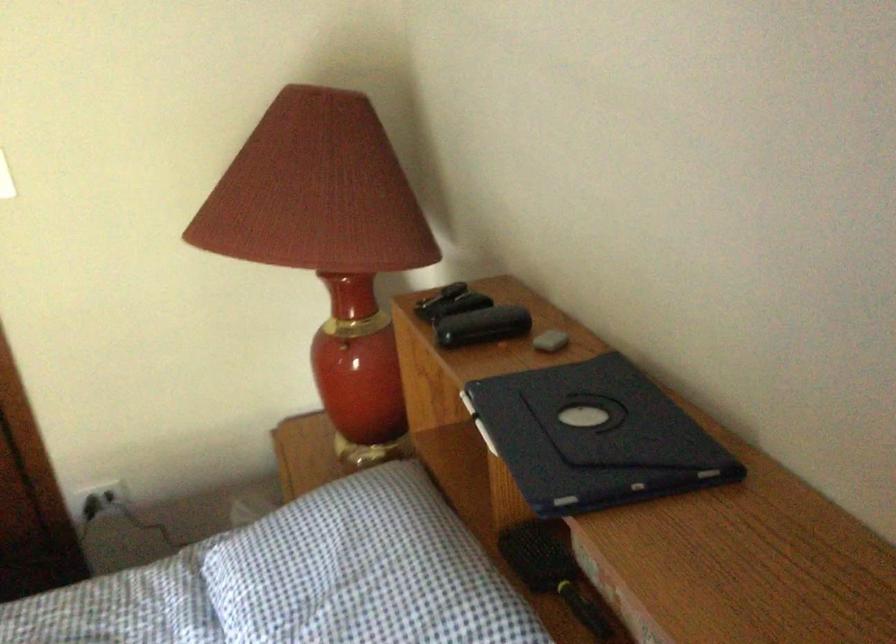
What do you see at coordinates (99, 500) in the screenshot? I see `the wall outlet` at bounding box center [99, 500].